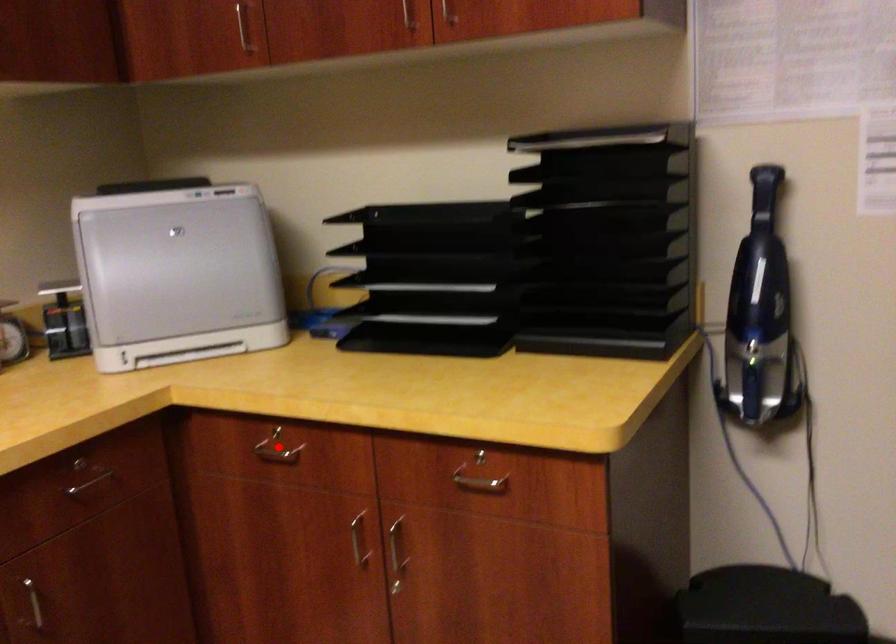
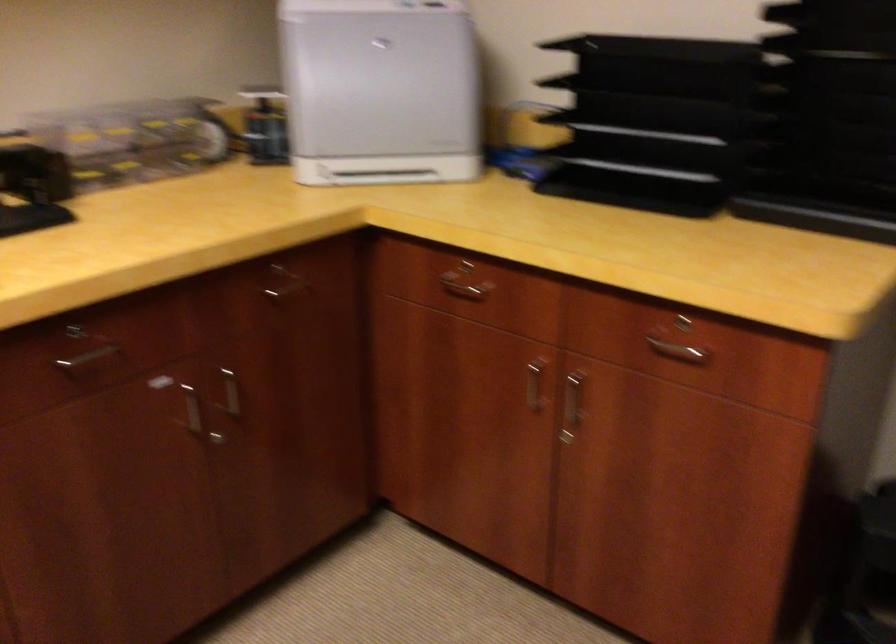
Where in the second image is the point corresponding to the highlighted location from the first image?

(464, 281)